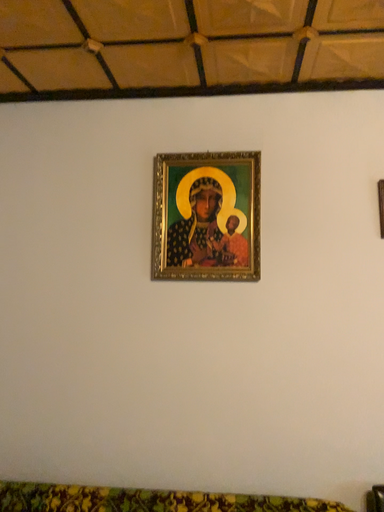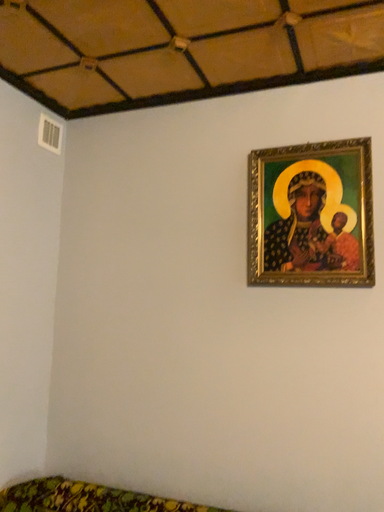
Question: Which way did the camera rotate in the video?

Choices:
 (A) rotated right
 (B) rotated left

Answer: (B)